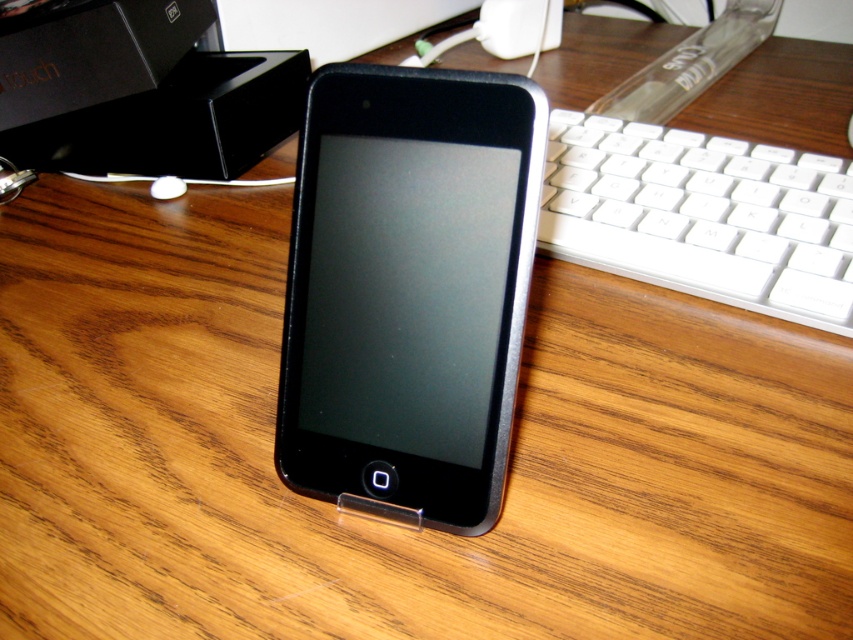
Question: Which object is farther from the camera taking this photo?

Choices:
 (A) white plastic keyboard at right
 (B) black matte smartphone at center

Answer: (A)

Question: Which point is farther to the camera?

Choices:
 (A) white plastic keyboard at right
 (B) black matte smartphone at center

Answer: (A)

Question: From the image, what is the correct spatial relationship of black matte smartphone at center in relation to white plastic keyboard at right?

Choices:
 (A) above
 (B) below

Answer: (B)

Question: Does black matte smartphone at center appear over white plastic keyboard at right?

Choices:
 (A) yes
 (B) no

Answer: (B)

Question: Which object appears closest to the camera in this image?

Choices:
 (A) black matte smartphone at center
 (B) white plastic keyboard at right

Answer: (A)

Question: From the image, what is the correct spatial relationship of black matte smartphone at center in relation to white plastic keyboard at right?

Choices:
 (A) right
 (B) left

Answer: (B)